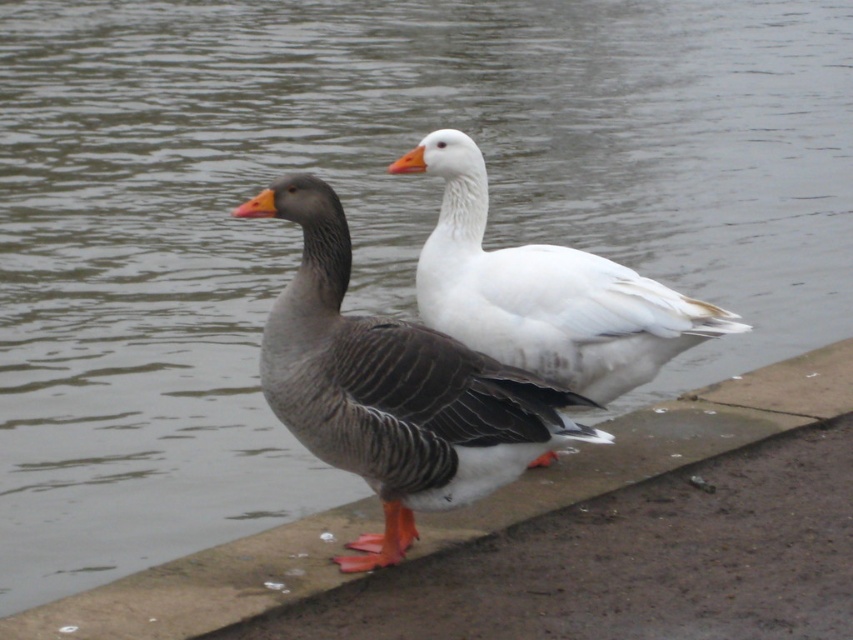
Can you confirm if white matte goose at center is smaller than concrete at center?

Correct, white matte goose at center occupies less space than concrete at center.

From the picture: Is white matte goose at center in front of concrete at center?

No, white matte goose at center is behind concrete at center.

Find the location of a particular element. white matte goose at center is located at coordinates (544, 291).

Does gray matte duck at center have a lesser width compared to white matte goose at center?

Yes.

Based on the photo, between gray matte duck at center and white matte goose at center, which one is positioned lower?

gray matte duck at center is below.

The image size is (853, 640). In order to click on gray matte duck at center in this screenshot , I will do `click(392, 387)`.

Find the location of a particular element. The height and width of the screenshot is (640, 853). gray matte duck at center is located at coordinates (392, 387).

Between point (294, 291) and point (346, 522), which one is positioned behind?

The point (346, 522) is more distant.

Find the location of a particular element. This screenshot has height=640, width=853. gray matte duck at center is located at coordinates (392, 387).